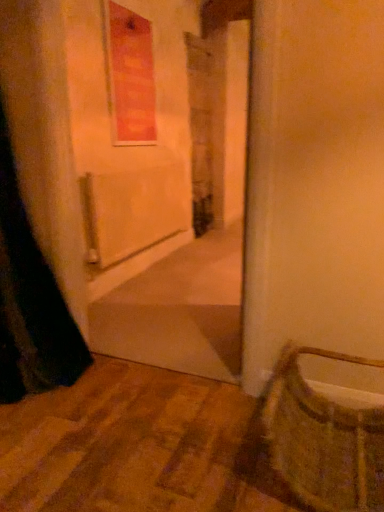
Question: Considering the relative positions of matte orange window at upper center and woven straw basket at lower right in the image provided, is matte orange window at upper center to the left or to the right of woven straw basket at lower right?

Choices:
 (A) right
 (B) left

Answer: (B)

Question: From their relative heights in the image, would you say matte orange window at upper center is taller or shorter than woven straw basket at lower right?

Choices:
 (A) short
 (B) tall

Answer: (B)

Question: From the image's perspective, is matte orange window at upper center positioned above or below woven straw basket at lower right?

Choices:
 (A) below
 (B) above

Answer: (B)

Question: Is woven straw basket at lower right bigger or smaller than matte orange window at upper center?

Choices:
 (A) big
 (B) small

Answer: (A)

Question: Based on their positions, is woven straw basket at lower right located to the left or right of matte orange window at upper center?

Choices:
 (A) left
 (B) right

Answer: (B)

Question: Looking at their shapes, would you say woven straw basket at lower right is wider or thinner than matte orange window at upper center?

Choices:
 (A) wide
 (B) thin

Answer: (A)

Question: From a real-world perspective, relative to matte orange window at upper center, is woven straw basket at lower right vertically above or below?

Choices:
 (A) below
 (B) above

Answer: (A)